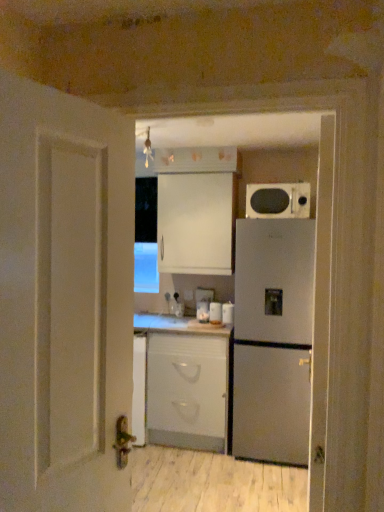
The height and width of the screenshot is (512, 384). What are the coordinates of `vacant space in front of white matte cabinet at center, which ranks as the 2th cabinetry in top-to-bottom order` in the screenshot? It's located at (205, 472).